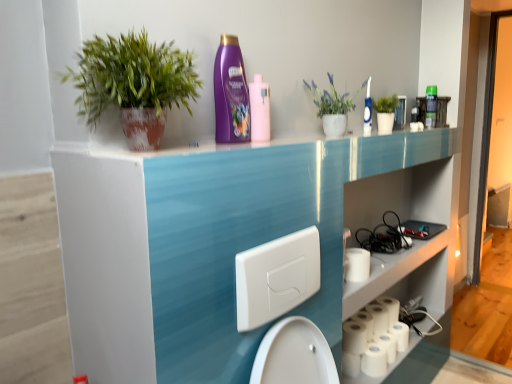
I want to click on purple glossy shampoo at upper center, the fourth cleaning product viewed from the right, so click(x=231, y=93).

How much space does white matte toilet paper at lower right, the third toilet paper when ordered from left to right, occupy vertically?

1.66 centimeters.

Describe the element at coordinates (368, 110) in the screenshot. I see `blue plastic toothbrush at upper right, marked as the third cleaning product in a left-to-right arrangement` at that location.

Locate an element on the screen. The image size is (512, 384). pink glossy bottle at upper center, positioned as the 2th cleaning product in left-to-right order is located at coordinates (259, 109).

Does point (319, 111) lie in front of point (372, 321)?

Yes, point (319, 111) is in front of point (372, 321).

Can you confirm if white textured pot at upper center, which appears as the 2th houseplant when viewed from the left, is positioned to the right of white matte toilet paper at lower right, marked as the second toilet paper in a right-to-left arrangement?

In fact, white textured pot at upper center, which appears as the 2th houseplant when viewed from the left, is to the left of white matte toilet paper at lower right, marked as the second toilet paper in a right-to-left arrangement.

Does white textured pot at upper center, which appears as the 2th houseplant when viewed from the left, have a lesser width compared to white matte toilet paper at lower right, the third toilet paper when ordered from left to right?

Yes.

What's the angular difference between white textured pot at upper center, arranged as the first houseplant when viewed from the right, and white matte toilet paper at lower right, the third toilet paper when ordered from left to right,'s facing directions?

There is a 0.676-degree angle between the facing directions of white textured pot at upper center, arranged as the first houseplant when viewed from the right, and white matte toilet paper at lower right, the third toilet paper when ordered from left to right.

Is white matte toilet paper at lower right, which appears as the second toilet paper when viewed from the left, turned away from pink glossy bottle at upper center, placed as the third cleaning product when sorted from back to front?

That's not correct — white matte toilet paper at lower right, which appears as the second toilet paper when viewed from the left, is not looking away from pink glossy bottle at upper center, placed as the third cleaning product when sorted from back to front.

In the scene shown: Could you measure the distance between white matte toilet paper at lower right, which appears as the second toilet paper when viewed from the left, and pink glossy bottle at upper center, positioned as the 2th cleaning product in left-to-right order?

A distance of 3.65 feet exists between white matte toilet paper at lower right, which appears as the second toilet paper when viewed from the left, and pink glossy bottle at upper center, positioned as the 2th cleaning product in left-to-right order.

In terms of height, does white matte toilet paper at lower right, which is counted as the 3th toilet paper, starting from the right, look taller or shorter compared to pink glossy bottle at upper center, positioned as the 2th cleaning product in left-to-right order?

Considering their sizes, white matte toilet paper at lower right, which is counted as the 3th toilet paper, starting from the right, has less height than pink glossy bottle at upper center, positioned as the 2th cleaning product in left-to-right order.

From the image's perspective, is white matte toilet paper at lower right, which appears as the second toilet paper when viewed from the left, located above or below pink glossy bottle at upper center, placed as the third cleaning product when sorted from back to front?

Clearly, from the image's perspective, white matte toilet paper at lower right, which appears as the second toilet paper when viewed from the left, is below pink glossy bottle at upper center, placed as the third cleaning product when sorted from back to front.

How many degrees apart are the facing directions of green matte plant at upper left, the first houseplant from the left, and white matte toilet paper at lower right, which ranks as the fourth toilet paper in left-to-right order?

0.266 degrees separate the facing orientations of green matte plant at upper left, the first houseplant from the left, and white matte toilet paper at lower right, which ranks as the fourth toilet paper in left-to-right order.

Measure the distance between green matte plant at upper left, the first houseplant from the left, and white matte toilet paper at lower right, which is the first toilet paper in right-to-left order.

A distance of 5.04 feet exists between green matte plant at upper left, the first houseplant from the left, and white matte toilet paper at lower right, which is the first toilet paper in right-to-left order.

Image resolution: width=512 pixels, height=384 pixels. Find the location of `the 2nd houseplant to the left of the white matte toilet paper at lower right, which is the first toilet paper in right-to-left order, counting from the anchor's position`. the 2nd houseplant to the left of the white matte toilet paper at lower right, which is the first toilet paper in right-to-left order, counting from the anchor's position is located at coordinates (133, 84).

Can you confirm if green matte plant at upper left, the first houseplant from the left, is wider than white matte toilet paper at lower right, which is the first toilet paper in right-to-left order?

Yes, green matte plant at upper left, the first houseplant from the left, is wider than white matte toilet paper at lower right, which is the first toilet paper in right-to-left order.

Would you say white matte toilet paper at lower right, which ranks as the fourth toilet paper in left-to-right order, is a long distance from white matte toilet paper at lower right, which is counted as the 3th toilet paper, starting from the right?

white matte toilet paper at lower right, which ranks as the fourth toilet paper in left-to-right order, is near white matte toilet paper at lower right, which is counted as the 3th toilet paper, starting from the right, not far away.

Between white matte toilet paper at lower right, which ranks as the fourth toilet paper in left-to-right order, and white matte toilet paper at lower right, which is counted as the 3th toilet paper, starting from the right, which one has larger size?

Bigger between the two is white matte toilet paper at lower right, which ranks as the fourth toilet paper in left-to-right order.

Consider the image. Could you tell me if white matte toilet paper at lower right, which is the first toilet paper in right-to-left order, is facing white matte toilet paper at lower right, which appears as the second toilet paper when viewed from the left?

No, white matte toilet paper at lower right, which is the first toilet paper in right-to-left order, is not facing towards white matte toilet paper at lower right, which appears as the second toilet paper when viewed from the left.

How much distance is there between pink glossy bottle at upper center, placed as the third cleaning product when sorted from back to front, and white matte toilet paper at lower right, marked as the second toilet paper in a right-to-left arrangement?

3.52 feet.

Looking at this image, is pink glossy bottle at upper center, which ranks as the third cleaning product in right-to-left order, surrounding white matte toilet paper at lower right, the third toilet paper when ordered from left to right?

No, white matte toilet paper at lower right, the third toilet paper when ordered from left to right, is not inside pink glossy bottle at upper center, which ranks as the third cleaning product in right-to-left order.

Is pink glossy bottle at upper center, positioned as the 2th cleaning product in left-to-right order, positioned before white matte toilet paper at lower right, marked as the second toilet paper in a right-to-left arrangement?

Yes, it is.

Find the location of a particular element. This screenshot has height=384, width=512. the 2nd cleaning product positioned above the white matte toilet paper at lower right, marked as the second toilet paper in a right-to-left arrangement (from a real-world perspective) is located at coordinates (259, 109).

From a real-world perspective, is white matte toilet paper at lower right, which appears as the second toilet paper when viewed from the left, positioned under white matte toilet paper at lower right, which is the first toilet paper in right-to-left order, based on gravity?

Yes.

Is white matte toilet paper at lower right, which appears as the second toilet paper when viewed from the left, turned away from white matte toilet paper at lower right, which is the first toilet paper in right-to-left order?

white matte toilet paper at lower right, which appears as the second toilet paper when viewed from the left, does not have its back to white matte toilet paper at lower right, which is the first toilet paper in right-to-left order.

Is white matte toilet paper at lower right, which is counted as the 3th toilet paper, starting from the right, placed right next to white matte toilet paper at lower right, which ranks as the fourth toilet paper in left-to-right order?

No, white matte toilet paper at lower right, which is counted as the 3th toilet paper, starting from the right, is not beside white matte toilet paper at lower right, which ranks as the fourth toilet paper in left-to-right order.

Could you tell me if white matte toilet paper at lower right, which is the first toilet paper in right-to-left order, is turned towards purple glossy shampoo at upper center, the fourth cleaning product viewed from the right?

No.

Does white matte toilet paper at lower right, which is the first toilet paper in right-to-left order, lie in front of purple glossy shampoo at upper center, placed as the 1th cleaning product when sorted from front to back?

No.

Can you confirm if white matte toilet paper at lower right, which is the first toilet paper in right-to-left order, is bigger than purple glossy shampoo at upper center, placed as the 1th cleaning product when sorted from left to right?

No, white matte toilet paper at lower right, which is the first toilet paper in right-to-left order, is not bigger than purple glossy shampoo at upper center, placed as the 1th cleaning product when sorted from left to right.

What are the coordinates of `toilet paper that is the 4th one when counting downward from the white textured pot at upper center, positioned as the 1th houseplant in back-to-front order (from the image's perspective)` in the screenshot? It's located at (373, 338).

Identify the location of the 2nd cleaning product directly above the white matte toilet paper at lower right, which is counted as the 3th toilet paper, starting from the right (from a real-world perspective). This screenshot has height=384, width=512. (259, 109).

Looking at the image, which one is located closer to white matte toilet paper at lower right, the third toilet paper when ordered from left to right, green matte plant at upper left, the first houseplant positioned from the front, or white matte toilet paper at lower right, which appears as the second toilet paper when viewed from the left?

white matte toilet paper at lower right, which appears as the second toilet paper when viewed from the left, is positioned closer to the anchor white matte toilet paper at lower right, the third toilet paper when ordered from left to right.

From the image, which object appears to be farther from white textured pot at upper center, arranged as the first houseplant when viewed from the right, white matte toilet paper at lower right, which is counted as the 3th toilet paper, starting from the right, or matte green spray bottle at upper right, the 1th cleaning product in the back-to-front sequence?

white matte toilet paper at lower right, which is counted as the 3th toilet paper, starting from the right, is further to white textured pot at upper center, arranged as the first houseplant when viewed from the right.

When comparing their distances from white matte toilet paper at lower right, which ranks as the fourth toilet paper in left-to-right order, does pink glossy bottle at upper center, which ranks as the third cleaning product in right-to-left order, or white matte toilet paper at lower right, which is counted as the 3th toilet paper, starting from the right, seem further?

Based on the image, pink glossy bottle at upper center, which ranks as the third cleaning product in right-to-left order, appears to be further to white matte toilet paper at lower right, which ranks as the fourth toilet paper in left-to-right order.

From the image, which object appears to be farther from white matte toilet paper at lower right, the fourth toilet paper when ordered from right to left, white matte paper towel at lower right or green matte plant at upper left, the first houseplant from the left?

green matte plant at upper left, the first houseplant from the left, lies further to white matte toilet paper at lower right, the fourth toilet paper when ordered from right to left, than the other object.

Based on the photo, looking at the image, which one is located further to matte green spray bottle at upper right, which is the fourth cleaning product from left to right, white matte toilet paper at lower right, marked as the 1th toilet paper in a left-to-right arrangement, or blue plastic toothbrush at upper right, positioned as the third cleaning product in front-to-back order?

white matte toilet paper at lower right, marked as the 1th toilet paper in a left-to-right arrangement, is further to matte green spray bottle at upper right, which is the fourth cleaning product from left to right.

Based on their spatial positions, is white matte toilet paper at lower right, marked as the 1th toilet paper in a left-to-right arrangement, or purple glossy shampoo at upper center, the fourth cleaning product positioned from the back, closer to white matte toilet paper at lower right, the third toilet paper when ordered from left to right?

The object closer to white matte toilet paper at lower right, the third toilet paper when ordered from left to right, is white matte toilet paper at lower right, marked as the 1th toilet paper in a left-to-right arrangement.

Estimate the real-world distances between objects in this image. Which object is further from white textured pot at upper center, arranged as the first houseplant when viewed from the right, pink glossy bottle at upper center, placed as the third cleaning product when sorted from back to front, or white matte paper towel at lower right?

The object further to white textured pot at upper center, arranged as the first houseplant when viewed from the right, is white matte paper towel at lower right.

When comparing their distances from white matte toilet paper at lower right, which appears as the second toilet paper when viewed from the left, does white matte toilet paper at lower right, marked as the second toilet paper in a right-to-left arrangement, or blue plastic toothbrush at upper right, positioned as the 2th cleaning product in right-to-left order, seem closer?

white matte toilet paper at lower right, marked as the second toilet paper in a right-to-left arrangement, is closer to white matte toilet paper at lower right, which appears as the second toilet paper when viewed from the left.

Identify the location of paper towel positioned between white textured pot at upper center, positioned as the 2th houseplant in front-to-back order, and matte green spray bottle at upper right, the 1th cleaning product in the back-to-front sequence, from near to far. (357, 264).

Find the location of a particular element. toilet paper between matte green spray bottle at upper right, the first cleaning product positioned from the right, and white matte toilet paper at lower right, which is the first toilet paper in right-to-left order, from top to bottom is located at coordinates (354, 337).

Identify the location of houseplant between purple glossy shampoo at upper center, the fourth cleaning product viewed from the right, and white matte toilet paper at lower right, marked as the second toilet paper in a right-to-left arrangement, from top to bottom. The image size is (512, 384). (133, 84).

You are a GUI agent. You are given a task and a screenshot of the screen. Output one action in this format:
    pyautogui.click(x=<x>, y=<y>)
    Task: Click on the paper towel that lies between white textured pot at upper center, arranged as the first houseplant when viewed from the right, and white matte toilet paper at lower right, which ranks as the fourth toilet paper in left-to-right order, from top to bottom
    Image resolution: width=512 pixels, height=384 pixels.
    Given the screenshot: What is the action you would take?
    pyautogui.click(x=357, y=264)